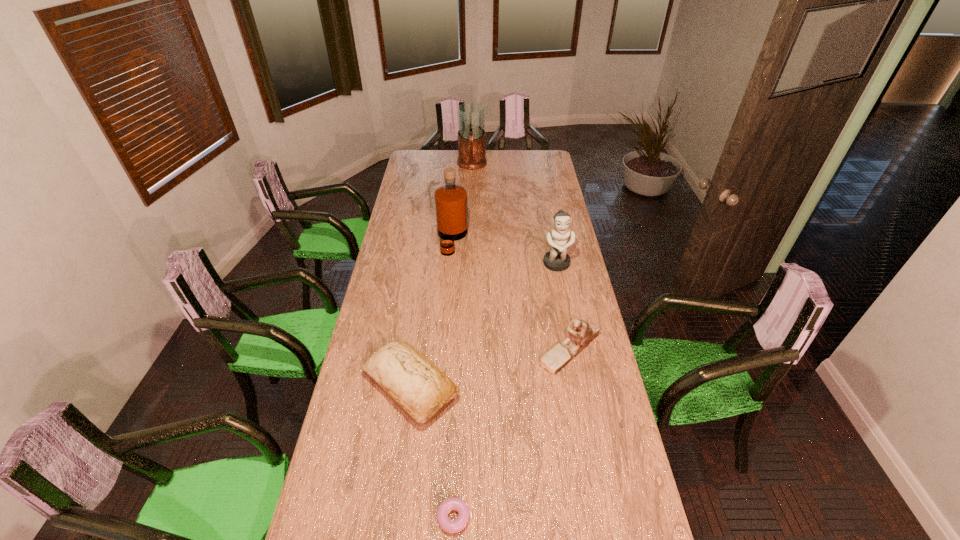
Locate an element on the screen. This screenshot has height=540, width=960. object that is the second nearest to the doughnut is located at coordinates (580, 334).

At what (x,y) coordinates should I click in order to perform the action: click on object that can be found as the fifth closest to the second shortest object. Please return your answer as a coordinate pair (x, y). The width and height of the screenshot is (960, 540). Looking at the image, I should click on (471, 116).